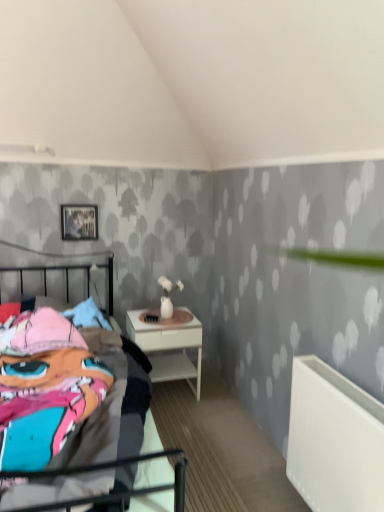
Question: Is multicolored fabric bed at left in contact with white plastic radiator at lower right?

Choices:
 (A) no
 (B) yes

Answer: (A)

Question: Considering the relative positions of multicolored fabric bed at left and white plastic radiator at lower right in the image provided, is multicolored fabric bed at left to the left of white plastic radiator at lower right from the viewer's perspective?

Choices:
 (A) no
 (B) yes

Answer: (B)

Question: Is multicolored fabric bed at left taller than white plastic radiator at lower right?

Choices:
 (A) no
 (B) yes

Answer: (B)

Question: From the image's perspective, is multicolored fabric bed at left beneath white plastic radiator at lower right?

Choices:
 (A) no
 (B) yes

Answer: (A)

Question: Is white plastic radiator at lower right completely or partially inside multicolored fabric bed at left?

Choices:
 (A) yes
 (B) no

Answer: (B)

Question: Is white glossy nightstand at center wider or thinner than white plastic radiator at lower right?

Choices:
 (A) wide
 (B) thin

Answer: (A)

Question: From a real-world perspective, is white glossy nightstand at center positioned above or below white plastic radiator at lower right?

Choices:
 (A) below
 (B) above

Answer: (A)

Question: Considering their positions, is white glossy nightstand at center located in front of or behind white plastic radiator at lower right?

Choices:
 (A) front
 (B) behind

Answer: (B)

Question: From the image's perspective, is white glossy nightstand at center above or below white plastic radiator at lower right?

Choices:
 (A) above
 (B) below

Answer: (A)

Question: Visually, is white glossy nightstand at center positioned to the left or to the right of metallic silver picture frame at upper left?

Choices:
 (A) right
 (B) left

Answer: (A)

Question: Is point (140, 337) closer or farther from the camera than point (74, 225)?

Choices:
 (A) farther
 (B) closer

Answer: (B)

Question: From the image's perspective, is white glossy nightstand at center positioned above or below metallic silver picture frame at upper left?

Choices:
 (A) above
 (B) below

Answer: (B)

Question: Relative to metallic silver picture frame at upper left, is white glossy nightstand at center in front or behind?

Choices:
 (A) behind
 (B) front

Answer: (B)

Question: Considering the positions of metallic silver picture frame at upper left and multicolored fabric bed at left in the image, is metallic silver picture frame at upper left wider or thinner than multicolored fabric bed at left?

Choices:
 (A) wide
 (B) thin

Answer: (B)

Question: Is point (91, 233) closer or farther from the camera than point (112, 408)?

Choices:
 (A) farther
 (B) closer

Answer: (A)